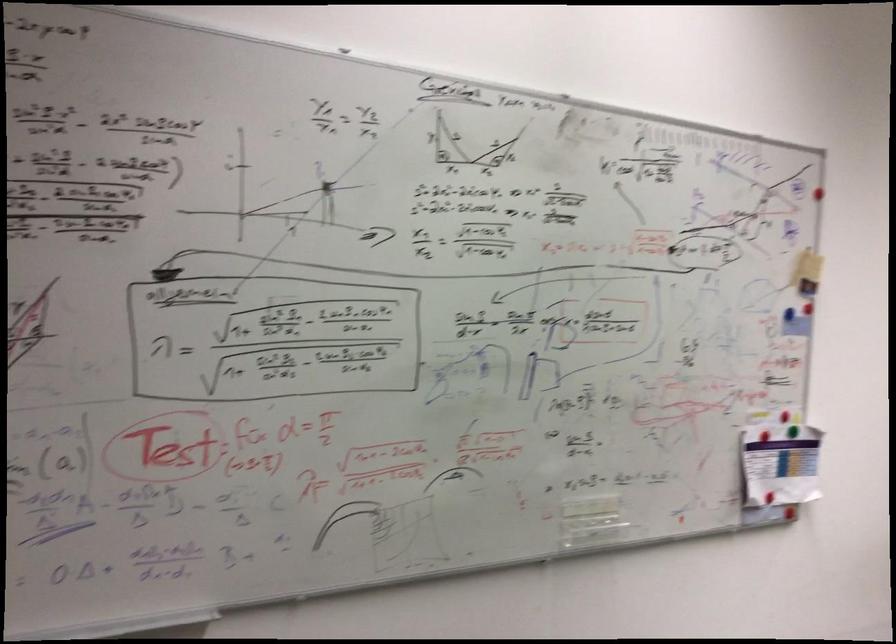
The width and height of the screenshot is (896, 644). Describe the element at coordinates (796, 323) in the screenshot. I see `a blue magnet` at that location.